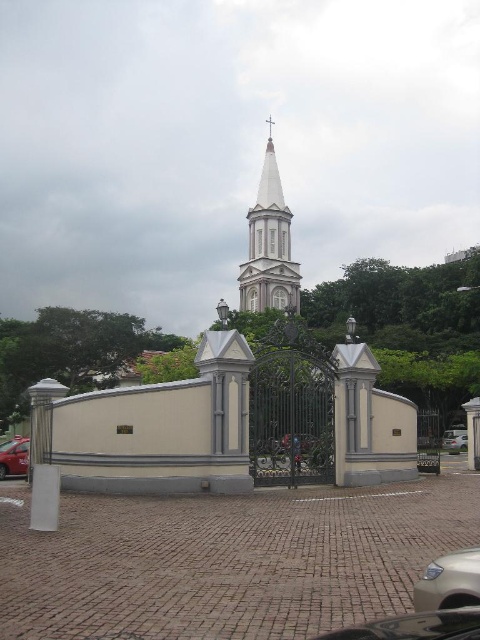
Does point (263, 204) lie behind point (19, 465)?

Yes, it is.

Can you confirm if white glossy steeple at center is thinner than metallic red taxi at lower left?

No.

Is point (276, 195) in front of point (9, 448)?

No, it is behind (9, 448).

Locate an element on the screen. white glossy steeple at center is located at coordinates (268, 244).

Between point (477, 552) and point (454, 449), which one is positioned behind?

Point (454, 449)

Is point (447, 576) positioned in front of point (457, 451)?

Yes.

This screenshot has height=640, width=480. In order to click on satin gold car at lower right in this screenshot , I will do `click(448, 580)`.

Between point (255, 266) and point (431, 566), which one is positioned in front?

Point (431, 566)

Does white glossy steeple at center appear over satin gold car at lower right?

Yes.

What do you see at coordinates (268, 244) in the screenshot? I see `white glossy steeple at center` at bounding box center [268, 244].

At what (x,y) coordinates should I click in order to perform the action: click on white glossy steeple at center. Please return your answer as a coordinate pair (x, y). Looking at the image, I should click on (268, 244).